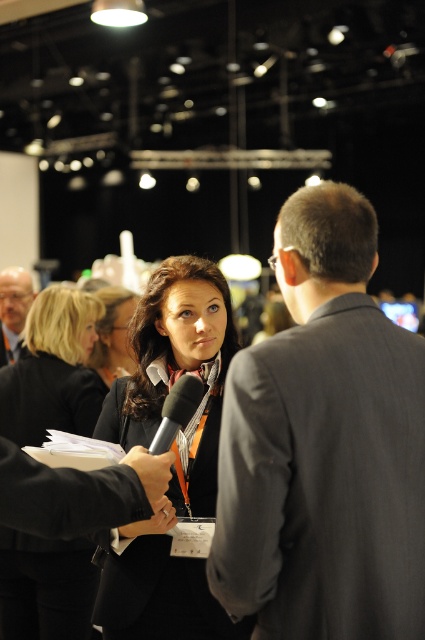
Question: In this image, where is black fabric jacket at center located relative to black matte microphone at center?

Choices:
 (A) above
 (B) below

Answer: (A)

Question: Which point is farther to the camera?

Choices:
 (A) (19, 285)
 (B) (218, 637)
 (C) (367, 224)
 (D) (22, 589)

Answer: (A)

Question: Is matte black suit at left smaller than black matte microphone at center?

Choices:
 (A) yes
 (B) no

Answer: (B)

Question: Which object is the farthest from the dark brown leather jacket at center?

Choices:
 (A) black fabric jacket at center
 (B) matte black suit at left

Answer: (B)

Question: Which point is closer to the camera?

Choices:
 (A) (2, 360)
 (B) (169, 545)
 (C) (121, 310)
 (D) (172, 436)

Answer: (D)

Question: Does dark brown leather jacket at center appear over black fabric jacket at center?

Choices:
 (A) no
 (B) yes

Answer: (A)